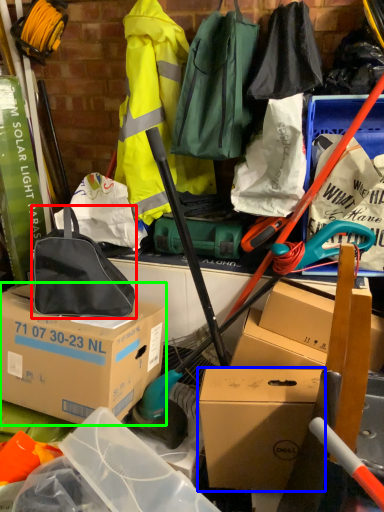
Question: Which is farther away from luggage and bags (highlighted by a red box)? box (highlighted by a blue box) or box (highlighted by a green box)?

Choices:
 (A) box
 (B) box

Answer: (A)